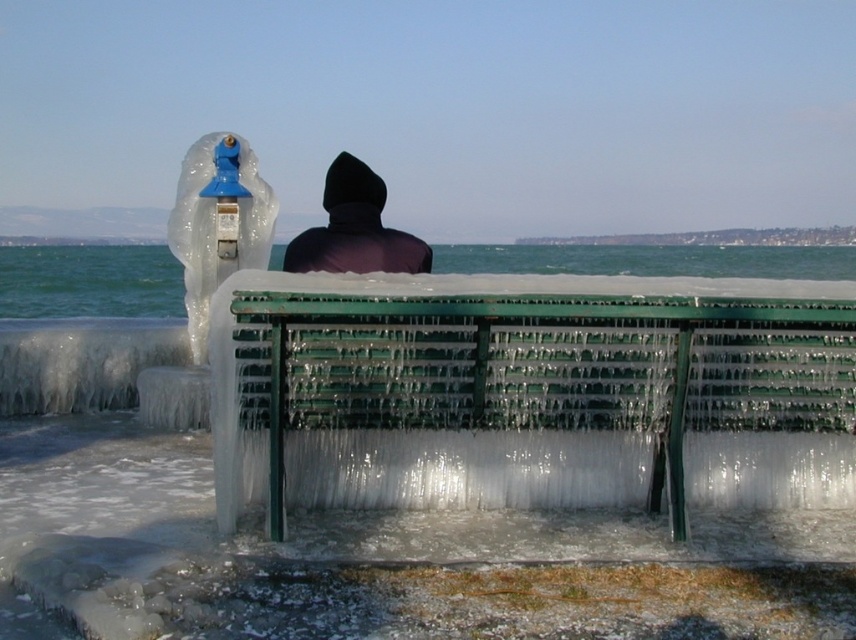
Which is above, translucent plastic ice sculpture at left or dark matte hood at center?

translucent plastic ice sculpture at left is above.

The image size is (856, 640). Identify the location of translucent plastic ice sculpture at left. (218, 224).

The image size is (856, 640). Identify the location of translucent plastic ice sculpture at left. (218, 224).

In the scene shown: Can you confirm if clear ice water at center is positioned to the left of dark matte hood at center?

Yes, clear ice water at center is to the left of dark matte hood at center.

Does point (42, 276) come behind point (411, 256)?

Yes, it is.

The height and width of the screenshot is (640, 856). What are the coordinates of `clear ice water at center` in the screenshot? It's located at tap(88, 282).

Based on the photo, is green plastic bench at center above clear ice water at center?

Incorrect, green plastic bench at center is not positioned above clear ice water at center.

Does point (599, 376) lie behind point (105, 250)?

No, (599, 376) is closer to viewer.

Find the location of a particular element. The height and width of the screenshot is (640, 856). green plastic bench at center is located at coordinates (530, 392).